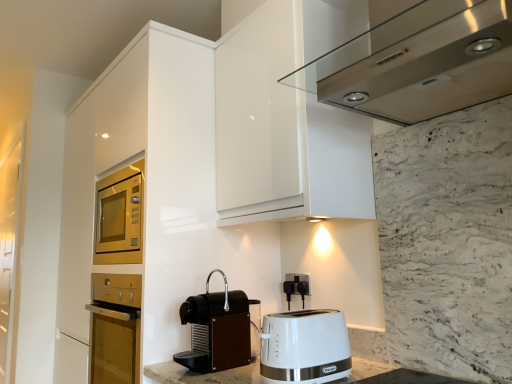
Question: Based on their sizes in the image, would you say white plastic toaster at lower center is bigger or smaller than black matte coffee machine at lower center?

Choices:
 (A) small
 (B) big

Answer: (A)

Question: Is point (318, 357) closer or farther from the camera than point (211, 321)?

Choices:
 (A) farther
 (B) closer

Answer: (B)

Question: Which is farther from the satin stainless steel range hood at upper center?

Choices:
 (A) transparent glass door at left
 (B) black plastic outlet at lower center
 (C) white plastic toaster at lower center
 (D) black matte coffee machine at lower center

Answer: (A)

Question: Considering the real-world distances, which object is closest to the satin stainless steel range hood at upper center?

Choices:
 (A) transparent glass door at left
 (B) black matte coffee machine at lower center
 (C) black plastic outlet at lower center
 (D) white plastic toaster at lower center

Answer: (D)